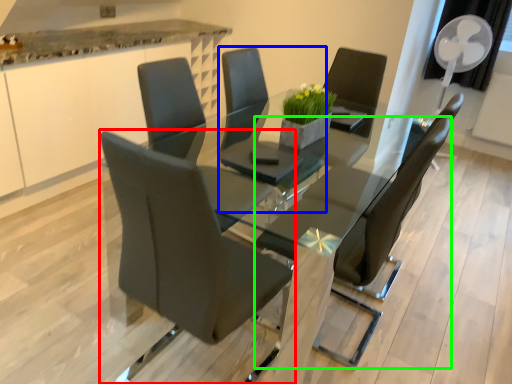
Question: Estimate the real-world distances between objects in this image. Which object is farther from chair (highlighted by a red box), chair (highlighted by a blue box) or chair (highlighted by a green box)?

Choices:
 (A) chair
 (B) chair

Answer: (A)